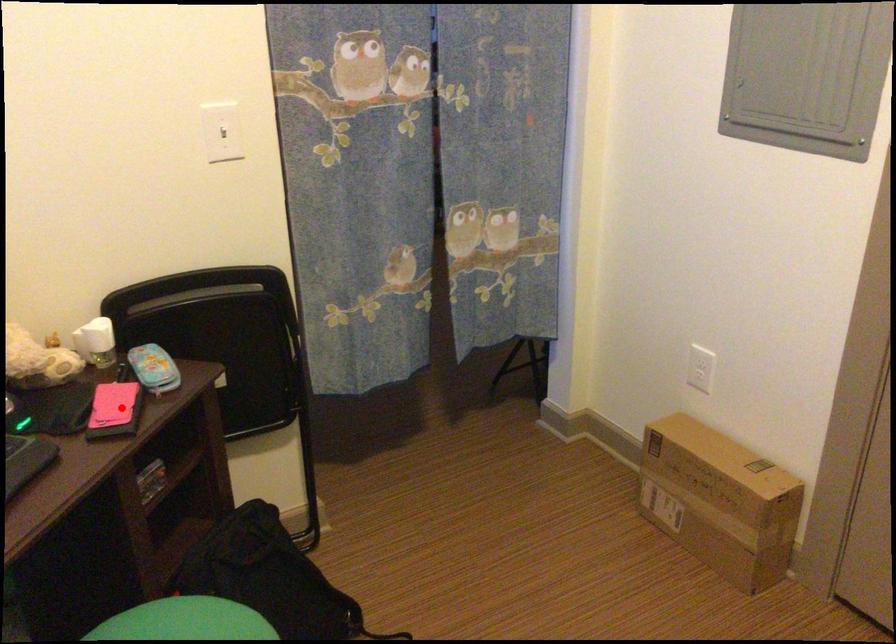
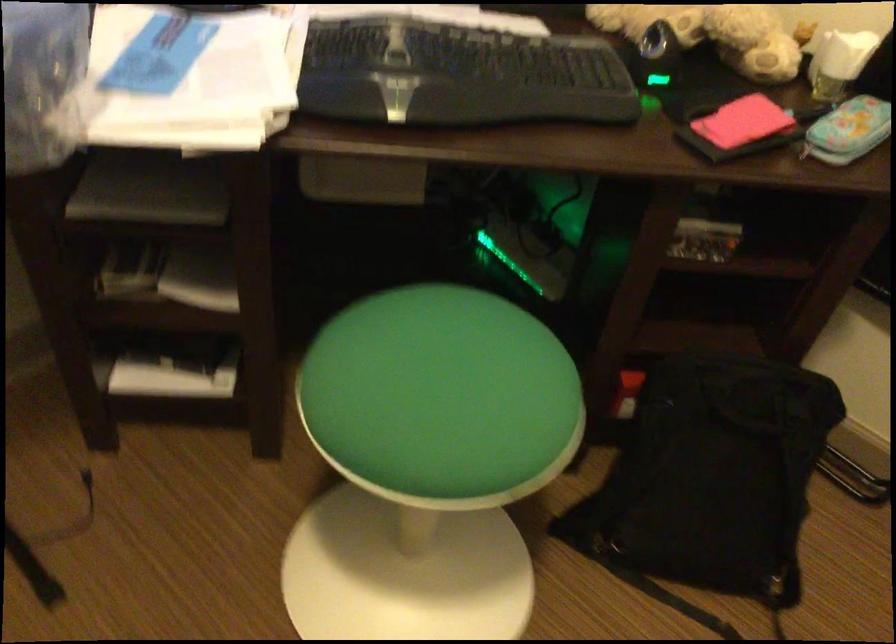
Question: I am providing you with two images of the same scene from different viewpoints. In image1, a red point is highlighted. Considering the same 3D point in image2, which of the following is correct?

Choices:
 (A) It is closer
 (B) It is farther

Answer: (A)